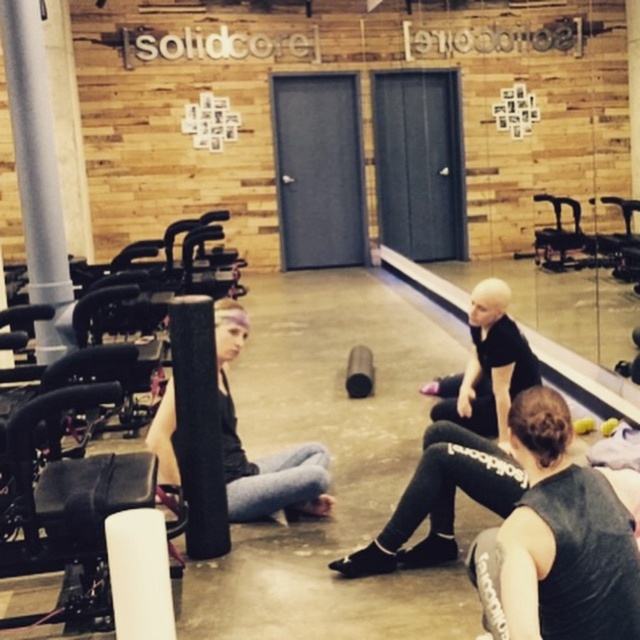
Locate an element on the screen. black matte leggings at lower right is located at coordinates (556, 541).

Is black matte leggings at lower right to the right of matte black squat at center from the viewer's perspective?

Indeed, black matte leggings at lower right is positioned on the right side of matte black squat at center.

Between point (577, 508) and point (234, 428), which one is positioned behind?

The point (234, 428) is more distant.

Locate an element on the screen. This screenshot has width=640, height=640. black matte leggings at lower right is located at coordinates (556, 541).